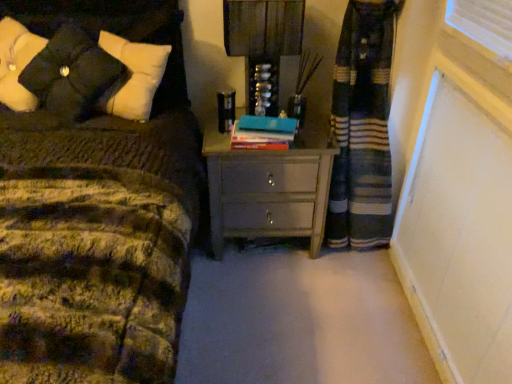
Question: Is matte black lampshade at upper center smaller than hardcover book at center?

Choices:
 (A) no
 (B) yes

Answer: (A)

Question: Can you confirm if matte black lampshade at upper center is taller than hardcover book at center?

Choices:
 (A) no
 (B) yes

Answer: (B)

Question: Can you confirm if matte black lampshade at upper center is wider than hardcover book at center?

Choices:
 (A) yes
 (B) no

Answer: (A)

Question: Considering the relative sizes of matte black lampshade at upper center and hardcover book at center in the image provided, is matte black lampshade at upper center thinner than hardcover book at center?

Choices:
 (A) no
 (B) yes

Answer: (A)

Question: Does matte black lampshade at upper center have a lesser height compared to hardcover book at center?

Choices:
 (A) no
 (B) yes

Answer: (A)

Question: In the image, is matte black lampshade at upper center positioned in front of or behind hardcover book at center?

Choices:
 (A) behind
 (B) front

Answer: (B)

Question: Is matte black lampshade at upper center bigger or smaller than hardcover book at center?

Choices:
 (A) big
 (B) small

Answer: (A)

Question: In terms of width, does matte black lampshade at upper center look wider or thinner when compared to hardcover book at center?

Choices:
 (A) thin
 (B) wide

Answer: (B)

Question: Choose the correct answer: Is matte black lampshade at upper center inside hardcover book at center or outside it?

Choices:
 (A) outside
 (B) inside

Answer: (A)

Question: Choose the correct answer: Is black matte pillow at upper left inside matte black lampshade at upper center or outside it?

Choices:
 (A) outside
 (B) inside

Answer: (A)

Question: Considering the relative positions of black matte pillow at upper left and matte black lampshade at upper center in the image provided, is black matte pillow at upper left to the left or to the right of matte black lampshade at upper center?

Choices:
 (A) right
 (B) left

Answer: (B)

Question: Is black matte pillow at upper left in front of or behind matte black lampshade at upper center in the image?

Choices:
 (A) front
 (B) behind

Answer: (A)

Question: In terms of width, does black matte pillow at upper left look wider or thinner when compared to matte black lampshade at upper center?

Choices:
 (A) wide
 (B) thin

Answer: (A)

Question: Looking at the image, does black matte pillow at upper left seem bigger or smaller compared to matte gray chest of drawers at center?

Choices:
 (A) big
 (B) small

Answer: (B)

Question: Is black matte pillow at upper left inside the boundaries of matte gray chest of drawers at center, or outside?

Choices:
 (A) outside
 (B) inside

Answer: (A)